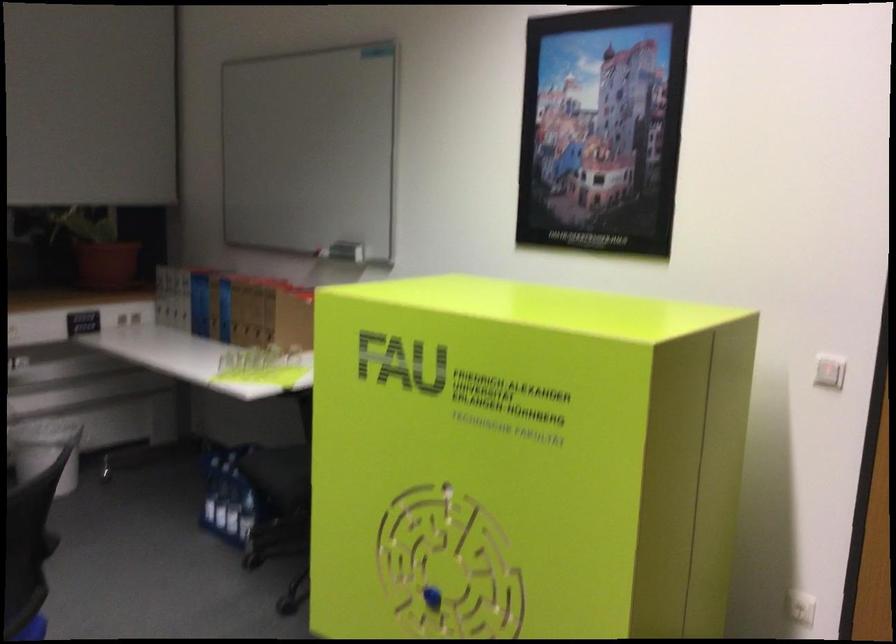
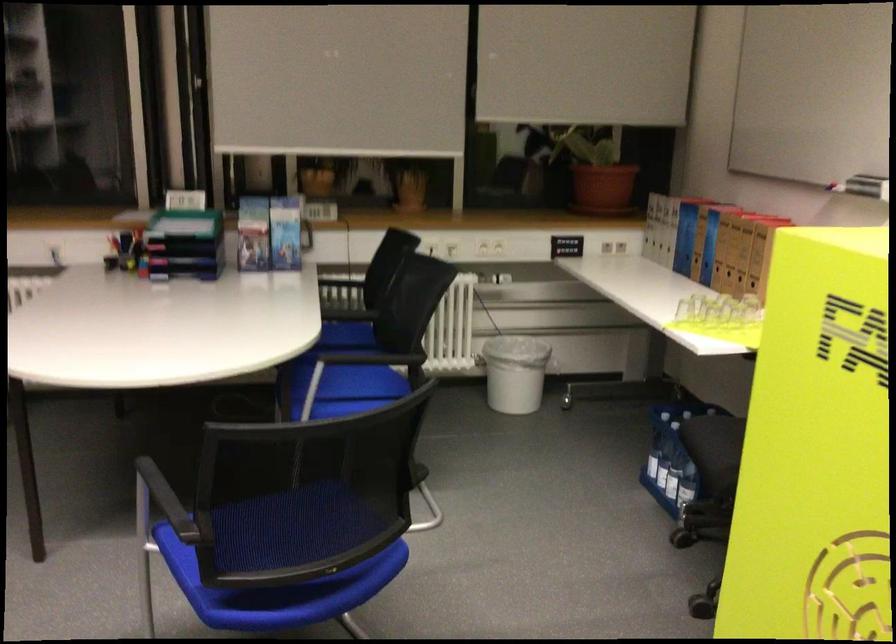
Find the pixel in the second image that matches point 228,509 in the first image.

(667, 471)